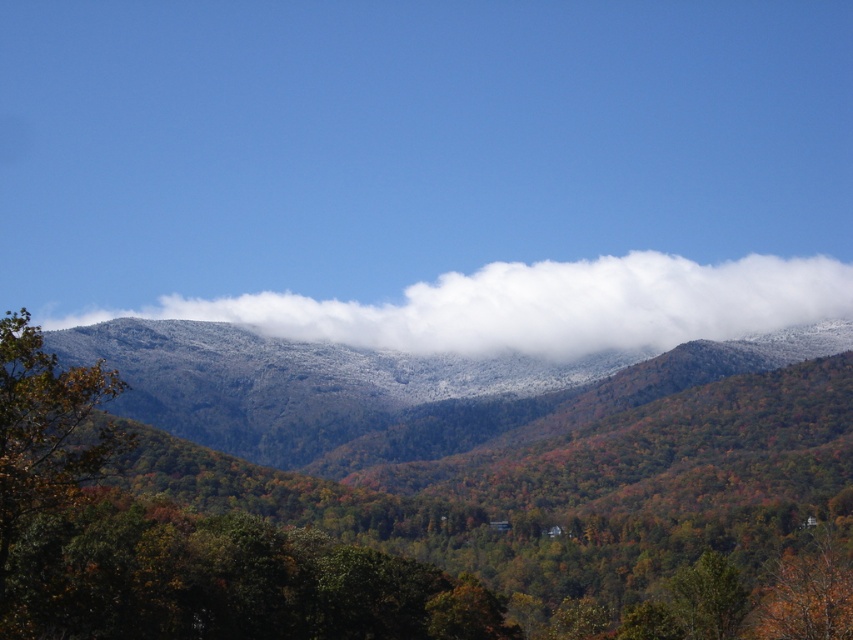
Between green matte forest at center and white fluffy cloud at upper center, which one appears on the left side from the viewer's perspective?

From the viewer's perspective, green matte forest at center appears more on the left side.

The height and width of the screenshot is (640, 853). I want to click on green matte forest at center, so click(396, 481).

This screenshot has height=640, width=853. What do you see at coordinates (396, 481) in the screenshot?
I see `green matte forest at center` at bounding box center [396, 481].

At what (x,y) coordinates should I click in order to perform the action: click on green matte forest at center. Please return your answer as a coordinate pair (x, y). Looking at the image, I should click on (396, 481).